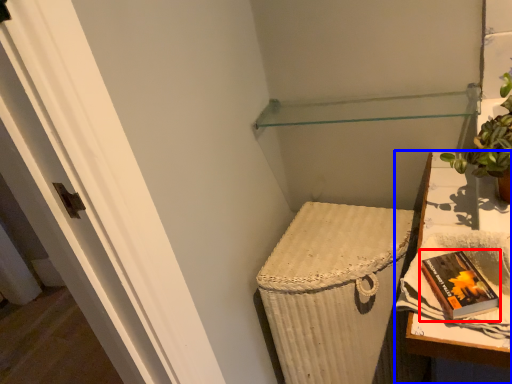
Question: Among these objects, which one is farthest to the camera, paperback book (highlighted by a red box) or table (highlighted by a blue box)?

Choices:
 (A) paperback book
 (B) table

Answer: (A)